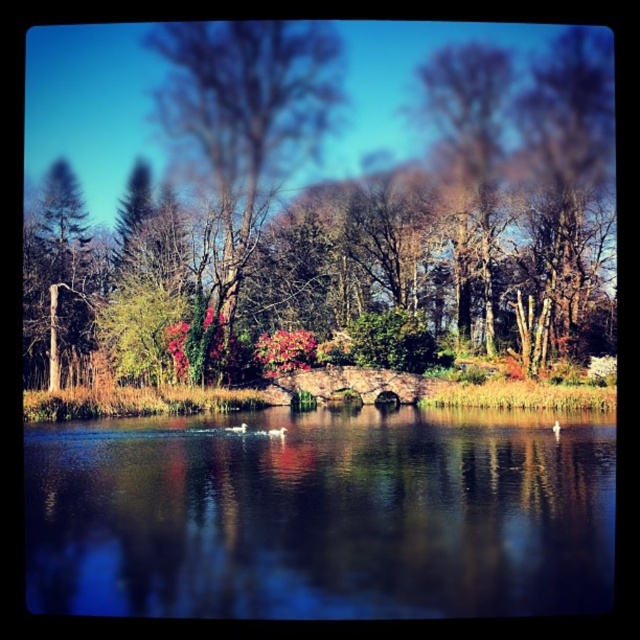
Question: Does green leafy tree at center appear on the left side of green matte tree at left?

Choices:
 (A) no
 (B) yes

Answer: (A)

Question: Does green leafy tree at center appear on the right side of green matte tree at left?

Choices:
 (A) yes
 (B) no

Answer: (A)

Question: Which of the following is the closest to the observer?

Choices:
 (A) (186, 125)
 (B) (67, 339)

Answer: (B)

Question: Observing the image, what is the correct spatial positioning of green leafy tree at center in reference to transparent water at center?

Choices:
 (A) above
 (B) below

Answer: (A)

Question: Which of the following is the closest to the observer?

Choices:
 (A) green matte tree at left
 (B) green leafy tree at center
 (C) smooth bark tree at center

Answer: (A)

Question: Among these points, which one is nearest to the camera?

Choices:
 (A) (65, 314)
 (B) (28, 561)
 (C) (600, 161)

Answer: (B)